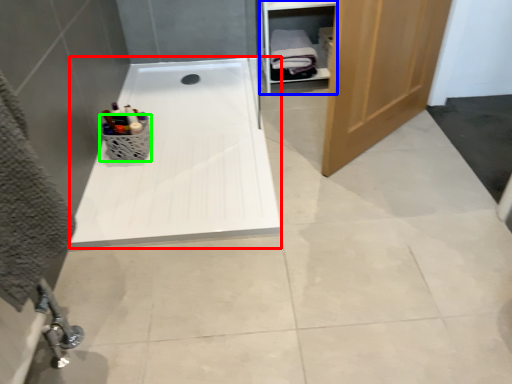
Question: Which is nearer to the bath (highlighted by a red box)? cabinet (highlighted by a blue box) or basket (highlighted by a green box).

Choices:
 (A) cabinet
 (B) basket

Answer: (B)